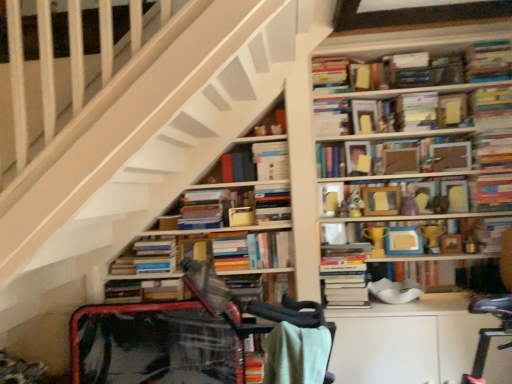
Question: From a real-world perspective, is hardcover books at lower left, the thirteenth book in the top-to-bottom sequence, positioned above or below wooden picture frame at upper center, acting as the eighth book starting from the top?

Choices:
 (A) above
 (B) below

Answer: (B)

Question: Looking at their shapes, would you say hardcover books at lower left, the thirteenth book in the top-to-bottom sequence, is wider or thinner than wooden picture frame at upper center, acting as the eighth book starting from the top?

Choices:
 (A) wide
 (B) thin

Answer: (A)

Question: Based on their relative distances, which object is nearer to the hardcover book at upper right, which is the tenth book in bottom-to-top order?

Choices:
 (A) hardcover book at upper right, the 16th book positioned from the bottom
 (B) matte yellow trophy at center, the sixth book ordered from the bottom
 (C) hardcover books at lower left, which appears as the 4th book when ordered from the bottom
 (D) wooden picture frame at upper center, acting as the eighth book starting from the top
 (E) wooden frame at upper center, positioned as the thirteenth book in bottom-to-top order

Answer: (B)

Question: Which object is positioned closest to the wooden picture frame at upper center, the ninth book ordered from the bottom?

Choices:
 (A) matte cardboard frame at upper center, which is the second paperback book in bottom-to-top order
 (B) hardcover books at center, marked as the eighth book in a bottom-to-top arrangement
 (C) hardcover books at center, which appears as the fourteenth book when viewed from the top
 (D) green cotton blanket at lower center
 (E) hardcover book at center, which is counted as the second book, starting from the bottom

Answer: (A)